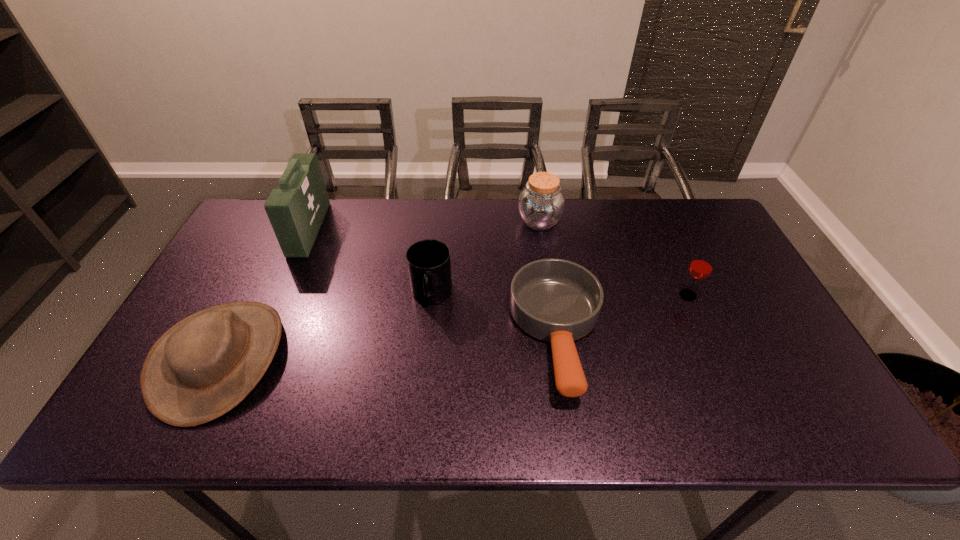
The width and height of the screenshot is (960, 540). What are the coordinates of `the first-aid kit` in the screenshot? It's located at coord(296,209).

Find the location of `jar`. jar is located at coordinates (541, 204).

You are a GUI agent. You are given a task and a screenshot of the screen. Output one action in this format:
    pyautogui.click(x=<x>, y=<y>)
    Task: Click on the glass
    
    Given the screenshot: What is the action you would take?
    pyautogui.click(x=701, y=266)

Identify the location of mug. The width and height of the screenshot is (960, 540). (429, 266).

You are a GUI agent. You are given a task and a screenshot of the screen. Output one action in this format:
    pyautogui.click(x=<x>, y=<y>)
    Task: Click on the fifth tallest object
    Image resolution: width=960 pixels, height=540 pixels.
    Given the screenshot: What is the action you would take?
    pyautogui.click(x=202, y=367)

Find the location of a particular element. the shortest object is located at coordinates (555, 300).

In order to click on vacant space situated on the front-facing side of the first-aid kit in this screenshot , I will do `click(385, 229)`.

Where is `vacant area situated on the front of the jar`? vacant area situated on the front of the jar is located at coordinates (552, 302).

At what (x,y) coordinates should I click in order to perform the action: click on vacant point located 0.170m on the right of the rightmost object. Please return your answer as a coordinate pair (x, y). The image size is (960, 540). Looking at the image, I should click on (759, 295).

You are a GUI agent. You are given a task and a screenshot of the screen. Output one action in this format:
    pyautogui.click(x=<x>, y=<y>)
    Task: Click on the free space located 0.170m on the side of the third object from left to right with the handle
    The height and width of the screenshot is (540, 960).
    Given the screenshot: What is the action you would take?
    pyautogui.click(x=423, y=371)